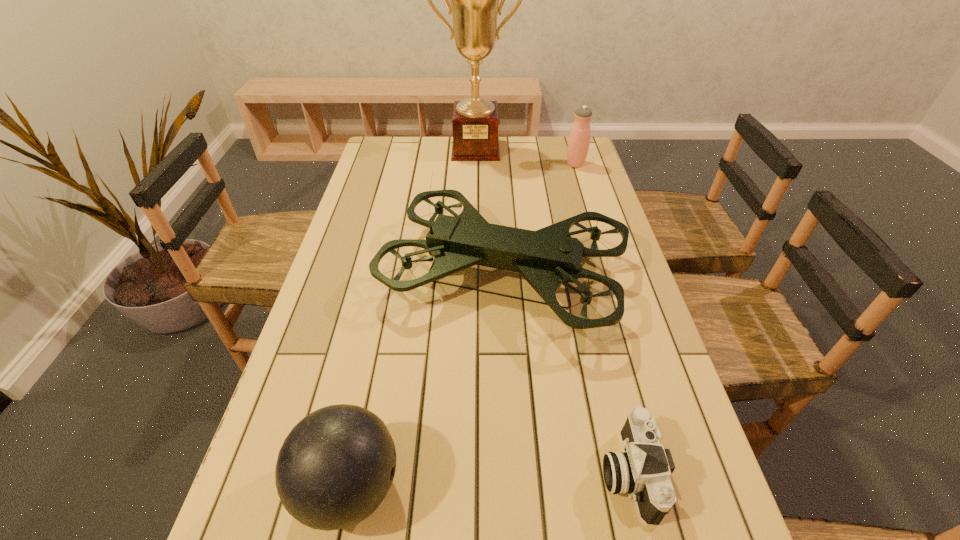
Identify the location of trophy cup. (474, 0).

This screenshot has height=540, width=960. I want to click on the third farthest object, so pos(546,258).

The width and height of the screenshot is (960, 540). I want to click on drone, so click(546, 258).

Find the location of a particular element. This screenshot has width=960, height=540. thermos bottle is located at coordinates (579, 139).

In order to click on the shortest object in this screenshot , I will do `click(643, 470)`.

You are a GUI agent. You are given a task and a screenshot of the screen. Output one action in this format:
    pyautogui.click(x=<x>, y=<y>)
    Task: Click on the free location located 0.070m on the plaque of the tallest object
    Image resolution: width=960 pixels, height=540 pixels.
    Given the screenshot: What is the action you would take?
    pyautogui.click(x=475, y=171)

The image size is (960, 540). What are the coordinates of `vacant space located on the left of the drone` in the screenshot? It's located at (331, 275).

Locate an element on the screen. This screenshot has width=960, height=540. vacant position located on the left of the thermos bottle is located at coordinates (492, 164).

Identify the location of vacant point located on the left of the shortest object. (497, 472).

At what (x,y) coordinates should I click in order to perform the action: click on trophy cup that is at the far edge. Please return your answer as a coordinate pair (x, y). Image resolution: width=960 pixels, height=540 pixels. Looking at the image, I should click on (474, 0).